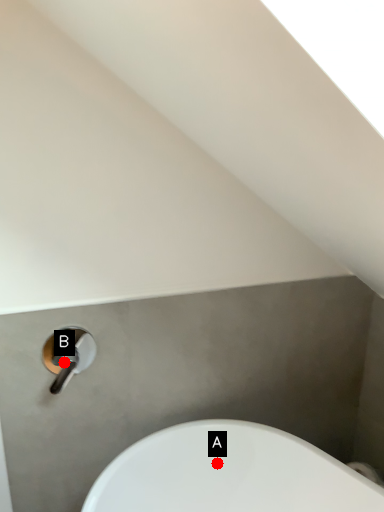
Question: Two points are circled on the image, labeled by A and B beside each circle. Which point is closer to the camera?

Choices:
 (A) A is closer
 (B) B is closer

Answer: (B)